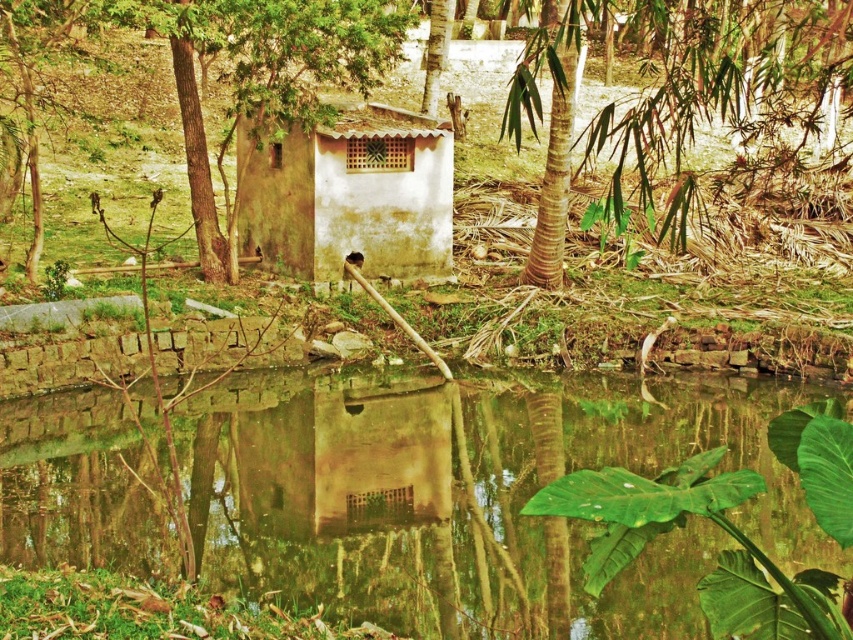
You are standing in front of the rustic building and want to take a photo of both the clear water at center and the brown textured bamboo at upper right. Can you frame both objects in your camera without moving your position?

The clear water at center is closer to the viewer than brown textured bamboo at upper right, so you can frame both objects in your camera without moving your position because they are at different distances but still within the camera frame.

You are standing at the edge of the water and looking at the scene. Which object, the matte white hut at center or the brown textured tree at center, appears closer to you in terms of size?

The matte white hut at center appears smaller than the brown textured tree at center, so the brown textured tree at center is closer to you.